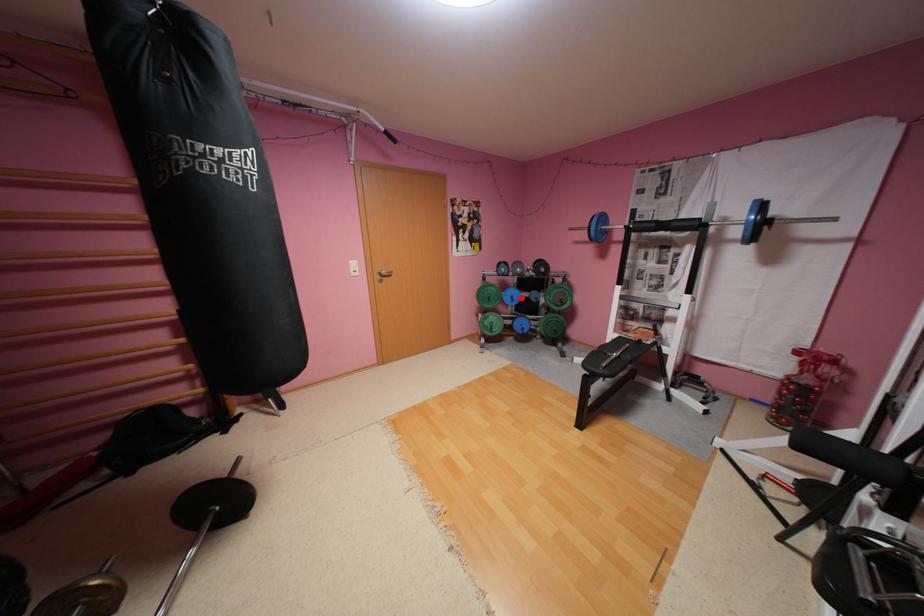
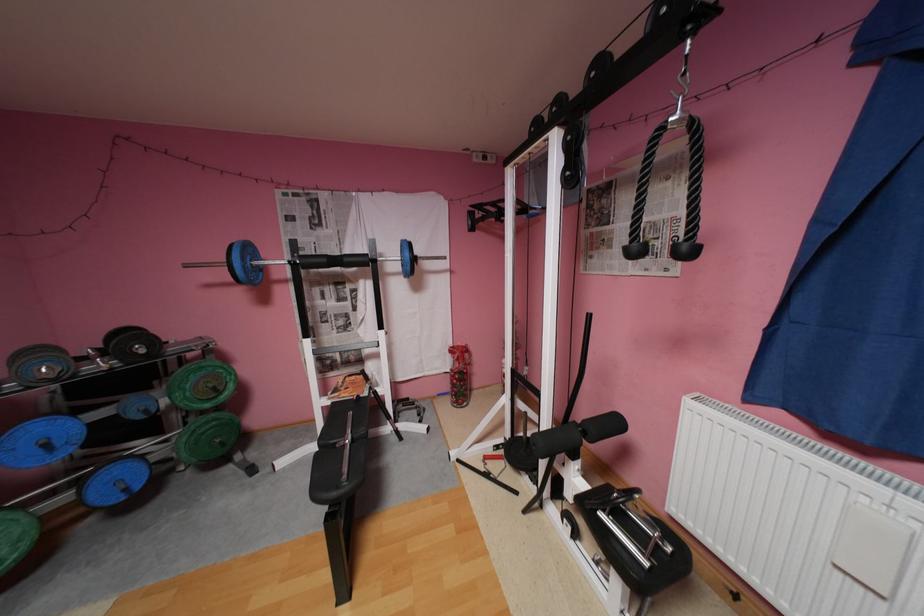
Locate, in the second image, the point that corresponds to the highlighted location in the first image.

(55, 445)